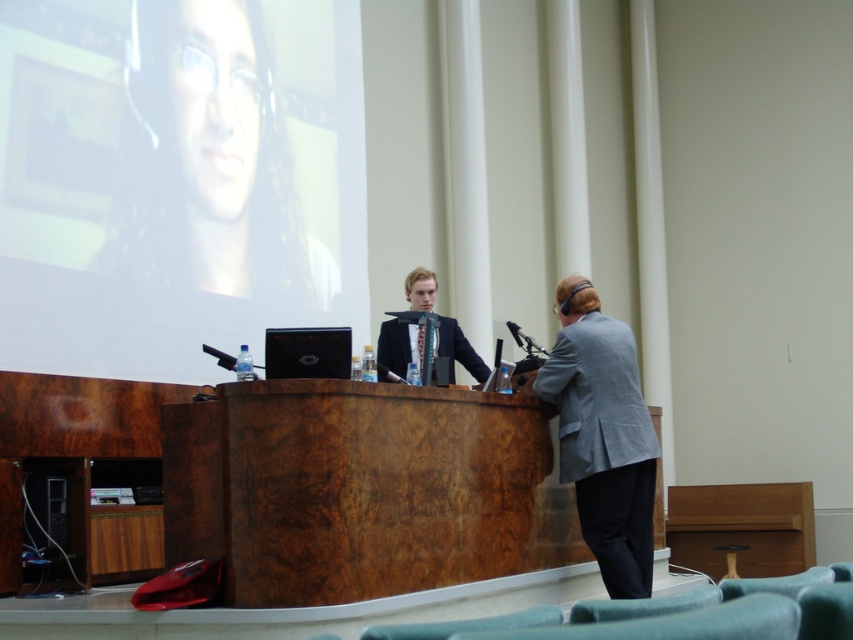
You are sitting in the audience and want to know which of the two points, point (247, 198) or point (648, 536), is closer to you. Can you determine this based on their positions?

Point (247, 198) is closer to you because it is further to the viewer than point (648, 536).

You are an event planner organizing a photo shoot in the conference room. You need to position the gray wool suit at right and the dark gray fabric business suit at center so that they appear balanced in the final image. Considering their heights, how should you arrange them?

Since the gray wool suit at right is much taller than the dark gray fabric business suit at center, to balance the image, you should place the taller gray wool suit at right further away from the camera and the shorter dark gray fabric business suit at center closer to the camera. This creates a visual balance by offsetting their height difference through positioning.

You are an event organizer who needs to adjust the seating arrangement for a panel discussion. The current setup has the gray wool suit at right and the matte black laptop at upper left. Which object should you move first to create space for an additional chair between them?

The gray wool suit at right is behind the matte black laptop at upper left. To create space between them, you should move the gray wool suit at right forward so it is no longer blocking the area in front of the matte black laptop at upper left.